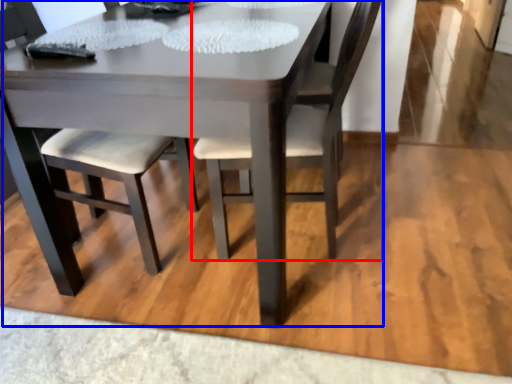
Question: Which object appears closest to the camera in this image, chair (highlighted by a red box) or kitchen & dining room table (highlighted by a blue box)?

Choices:
 (A) chair
 (B) kitchen & dining room table

Answer: (B)